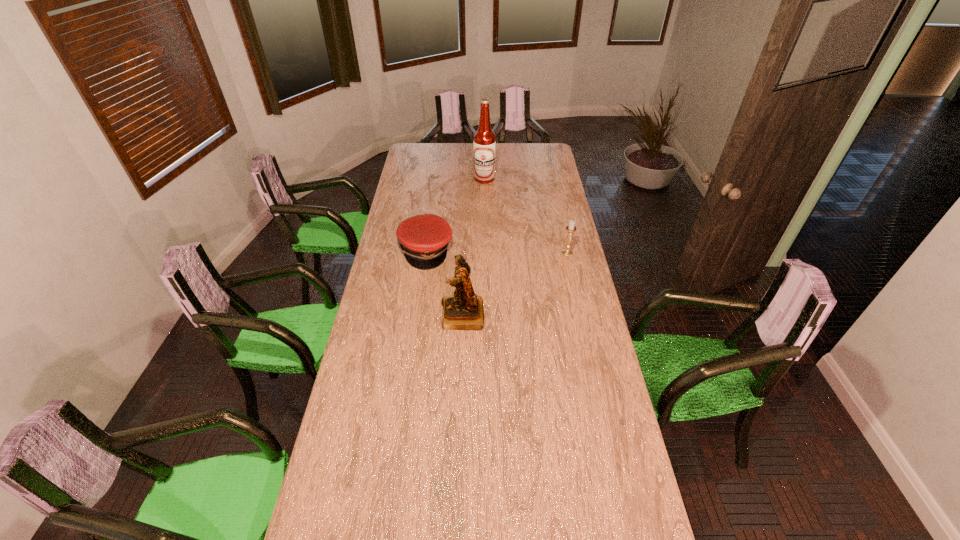
This screenshot has width=960, height=540. In order to click on free space at the left edge of the desktop in this screenshot , I will do `click(376, 394)`.

In the image, there is a desktop. Identify the location of vacant space at the right edge. (560, 195).

Identify the location of free space at the far left corner of the desktop. (405, 161).

This screenshot has width=960, height=540. In the image, there is a desktop. Find the location of `blank space at the near left corner`. blank space at the near left corner is located at coordinates (367, 491).

Where is `free location at the far right corner`? free location at the far right corner is located at coordinates (532, 147).

The height and width of the screenshot is (540, 960). Find the location of `free area in between the rightmost object and the farthest object`. free area in between the rightmost object and the farthest object is located at coordinates (526, 216).

At what (x,y) coordinates should I click in order to perform the action: click on free spot between the figurine and the shortest object. Please return your answer as a coordinate pair (x, y). Image resolution: width=960 pixels, height=540 pixels. Looking at the image, I should click on (444, 283).

The height and width of the screenshot is (540, 960). I want to click on empty location between the shortest object and the candle holder, so click(496, 252).

Identify the location of free area in between the figurine and the rightmost object. The width and height of the screenshot is (960, 540). (515, 284).

Locate an element on the screen. Image resolution: width=960 pixels, height=540 pixels. free space that is in between the candle holder and the nearest object is located at coordinates (515, 284).